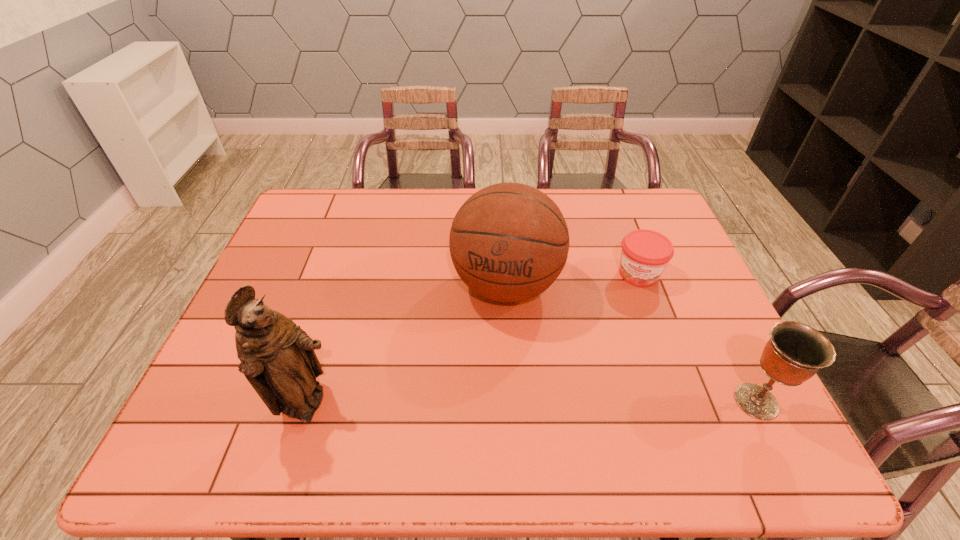
Locate an element on the screen. This screenshot has width=960, height=540. vacant space located on the label side of the jam is located at coordinates point(617,345).

Identify the location of free space located 0.120m on the side with brand label of the third object from right to left. The height and width of the screenshot is (540, 960). (487, 364).

The height and width of the screenshot is (540, 960). Identify the location of vacant space located 0.120m on the side with brand label of the third object from right to left. (487, 364).

Locate an element on the screen. vacant space situated on the side with brand label of the third object from right to left is located at coordinates (488, 361).

At what (x,y) coordinates should I click in order to perform the action: click on figurine present at the near edge. Please return your answer as a coordinate pair (x, y). The width and height of the screenshot is (960, 540). Looking at the image, I should click on (277, 357).

In order to click on chalice located at the near edge in this screenshot , I will do (795, 352).

The height and width of the screenshot is (540, 960). I want to click on chalice present at the right edge, so click(795, 352).

Where is `jam that is positioned at the right edge`? The height and width of the screenshot is (540, 960). jam that is positioned at the right edge is located at coordinates (645, 254).

Locate an element on the screen. This screenshot has width=960, height=540. object that is at the near right corner is located at coordinates point(795,352).

In the image, there is a desktop. Where is `free space at the far edge`? This screenshot has height=540, width=960. free space at the far edge is located at coordinates (600, 216).